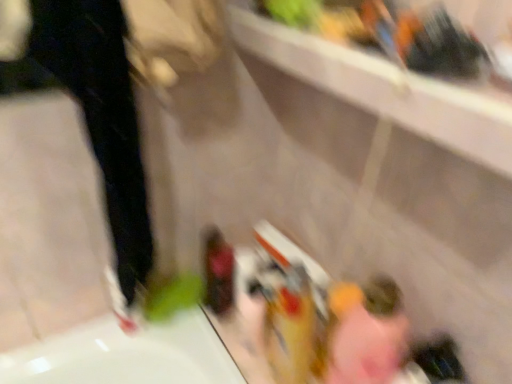
Question: From a real-world perspective, is white matte shoe at lower left positioned over black matte pants at left based on gravity?

Choices:
 (A) yes
 (B) no

Answer: (B)

Question: Is the position of white matte shoe at lower left less distant than that of black matte pants at left?

Choices:
 (A) yes
 (B) no

Answer: (B)

Question: Would you consider white matte shoe at lower left to be distant from black matte pants at left?

Choices:
 (A) no
 (B) yes

Answer: (A)

Question: Does white matte shoe at lower left have a greater width compared to black matte pants at left?

Choices:
 (A) yes
 (B) no

Answer: (B)

Question: Is black matte pants at left located within white matte shoe at lower left?

Choices:
 (A) yes
 (B) no

Answer: (B)

Question: From a real-world perspective, is white matte shoe at lower left beneath black matte pants at left?

Choices:
 (A) no
 (B) yes

Answer: (B)

Question: Can you confirm if black matte pants at left is bigger than white matte shoe at lower left?

Choices:
 (A) no
 (B) yes

Answer: (B)

Question: From the image's perspective, would you say black matte pants at left is positioned over white matte shoe at lower left?

Choices:
 (A) no
 (B) yes

Answer: (B)

Question: Does black matte pants at left have a greater width compared to white matte shoe at lower left?

Choices:
 (A) no
 (B) yes

Answer: (B)

Question: Is black matte pants at left to the right of white matte shoe at lower left from the viewer's perspective?

Choices:
 (A) yes
 (B) no

Answer: (A)

Question: Does black matte pants at left have a lesser width compared to white matte shoe at lower left?

Choices:
 (A) yes
 (B) no

Answer: (B)

Question: Does black matte pants at left turn towards white matte shoe at lower left?

Choices:
 (A) no
 (B) yes

Answer: (A)

Question: Are pink fabric at lower right and black matte pants at left located far from each other?

Choices:
 (A) yes
 (B) no

Answer: (B)